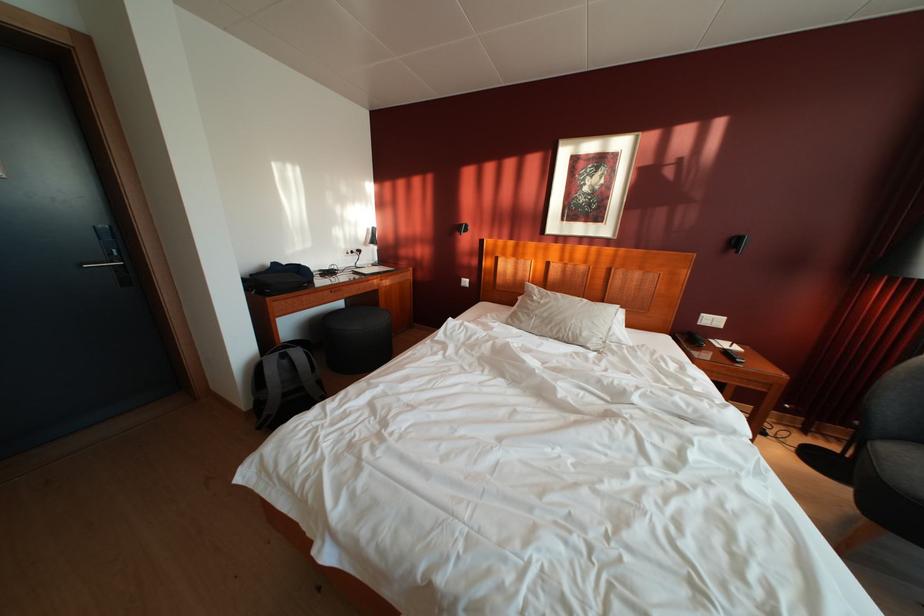
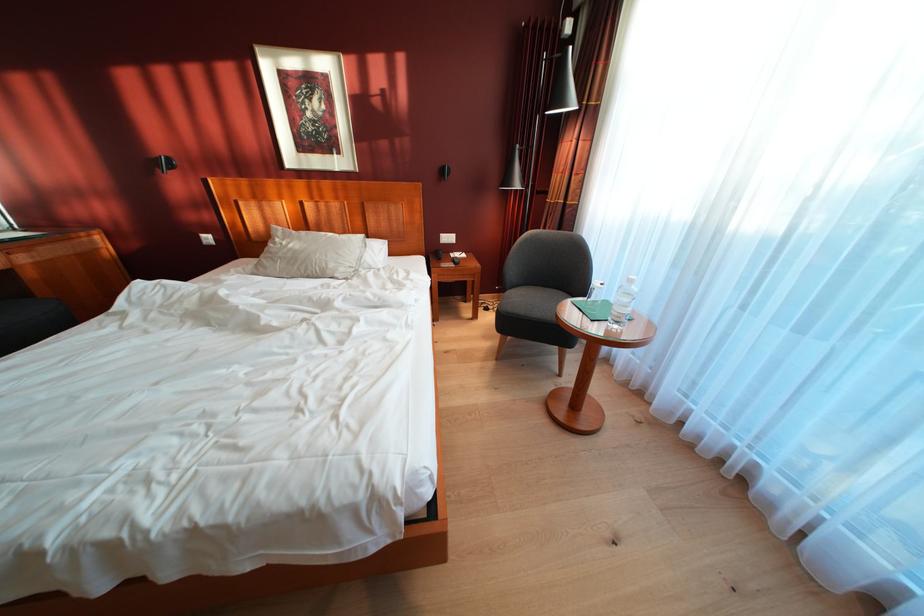
Find the pixel in the second image that matches pixel 711 321 in the first image.

(450, 241)